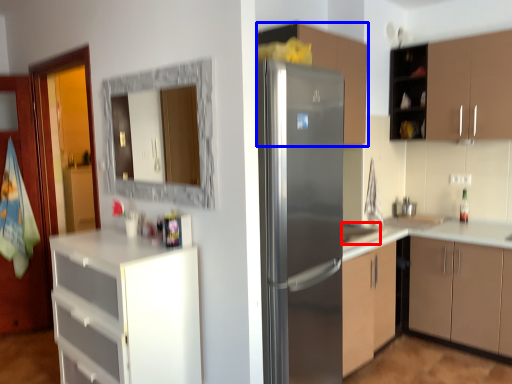
Question: Which of the following is the farthest to the observer, sink (highlighted by a red box) or cabinetry (highlighted by a blue box)?

Choices:
 (A) sink
 (B) cabinetry

Answer: (A)